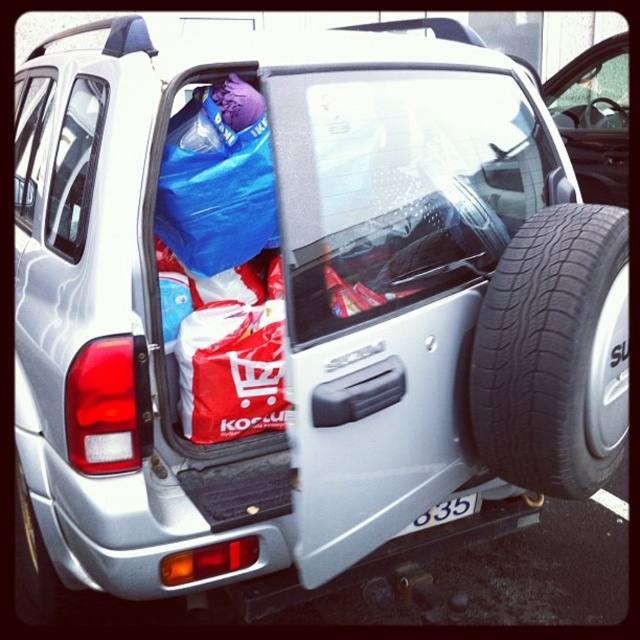
You are a delivery person who needs to place a large box in the trunk of the silver SUV. The trunk has items already inside. You notice the matte black car door at upper center and the white plastic license plate at center. Which object should you open to access the trunk?

You should open the matte black car door at upper center to access the trunk because the white plastic license plate at center is positioned to the left of it and is not an entry point to the trunk.

You are a delivery person trying to load a package onto the trunk of the silver SUV. The package requires placing it at point 0.6, 0.8. Is the black rubber tire at rear in the way?

The black rubber tire at rear is located at point (554,353), which is close to the desired placement point of (512,384). It might obstruct the placement, so you should check the exact position before proceeding.